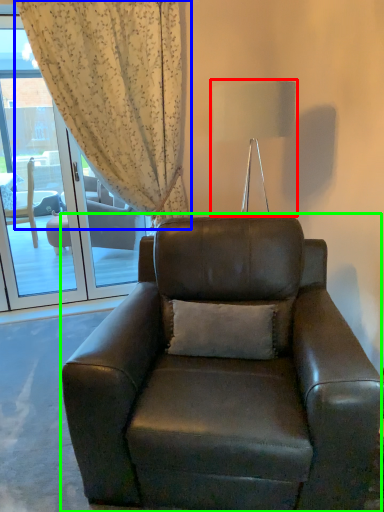
Question: Estimate the real-world distances between objects in this image. Which object is farther from lamp (highlighted by a red box), curtain (highlighted by a blue box) or chair (highlighted by a green box)?

Choices:
 (A) curtain
 (B) chair

Answer: (B)